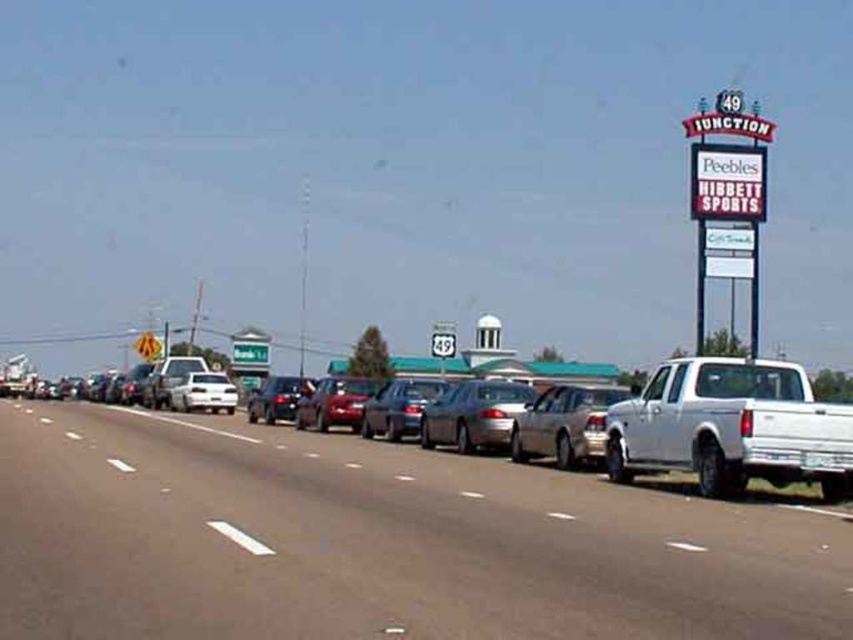
Question: Which of the following is the closest to the observer?

Choices:
 (A) silver metallic sedan at center
 (B) shiny red sedan at center
 (C) gray asphalt road at center

Answer: (C)

Question: Can you confirm if gray asphalt road at center is smaller than shiny black sedan at center?

Choices:
 (A) no
 (B) yes

Answer: (B)

Question: Which of these objects is positioned closest to the white glossy line at center?

Choices:
 (A) white matte truck at right
 (B) metallic gray sedan at center
 (C) gray asphalt road at center
 (D) shiny red sedan at center

Answer: (C)

Question: Which of the following is the farthest from the observer?

Choices:
 (A) white matte sedan at center
 (B) shiny black sedan at center
 (C) gray asphalt road at center

Answer: (A)

Question: Does satin silver sedan at center have a greater width compared to shiny black sedan at center?

Choices:
 (A) yes
 (B) no

Answer: (B)

Question: Can you confirm if white matte truck at right is positioned above satin silver sedan at center?

Choices:
 (A) no
 (B) yes

Answer: (B)